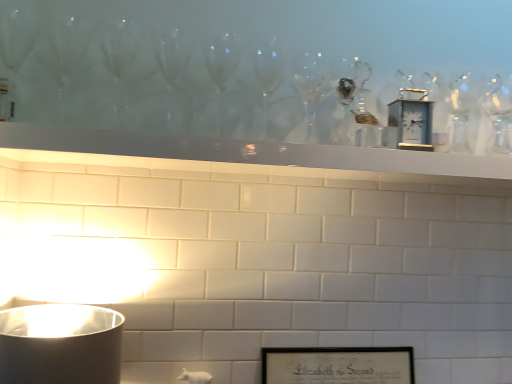
Question: From a real-world perspective, is white glossy mantle at upper center on top of metallic silver clock at upper center?

Choices:
 (A) yes
 (B) no

Answer: (B)

Question: Considering the relative sizes of white glossy mantle at upper center and metallic silver clock at upper center in the image provided, is white glossy mantle at upper center wider than metallic silver clock at upper center?

Choices:
 (A) yes
 (B) no

Answer: (A)

Question: Are white glossy mantle at upper center and metallic silver clock at upper center making contact?

Choices:
 (A) no
 (B) yes

Answer: (A)

Question: Is white glossy mantle at upper center not near metallic silver clock at upper center?

Choices:
 (A) no
 (B) yes

Answer: (A)

Question: Is white glossy mantle at upper center located outside metallic silver clock at upper center?

Choices:
 (A) no
 (B) yes

Answer: (B)

Question: Is metallic silver clock at upper center inside white glossy mantle at upper center?

Choices:
 (A) yes
 (B) no

Answer: (B)

Question: Does metallic silver clock at upper center have a greater width compared to black matte picture frame at lower center?

Choices:
 (A) yes
 (B) no

Answer: (B)

Question: Is metallic silver clock at upper center taller than black matte picture frame at lower center?

Choices:
 (A) no
 (B) yes

Answer: (B)

Question: Is metallic silver clock at upper center thinner than black matte picture frame at lower center?

Choices:
 (A) no
 (B) yes

Answer: (B)

Question: Can black matte picture frame at lower center be found inside metallic silver clock at upper center?

Choices:
 (A) no
 (B) yes

Answer: (A)

Question: Is metallic silver clock at upper center bigger than black matte picture frame at lower center?

Choices:
 (A) no
 (B) yes

Answer: (A)

Question: From a real-world perspective, is metallic silver clock at upper center positioned under black matte picture frame at lower center based on gravity?

Choices:
 (A) yes
 (B) no

Answer: (B)

Question: Is black matte picture frame at lower center thinner than white glossy mantle at upper center?

Choices:
 (A) no
 (B) yes

Answer: (B)